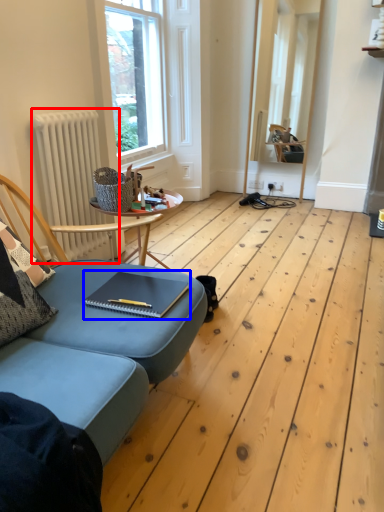
Question: Which of the following is the farthest to the observer, radiator (highlighted by a red box) or notebook (highlighted by a blue box)?

Choices:
 (A) radiator
 (B) notebook

Answer: (A)